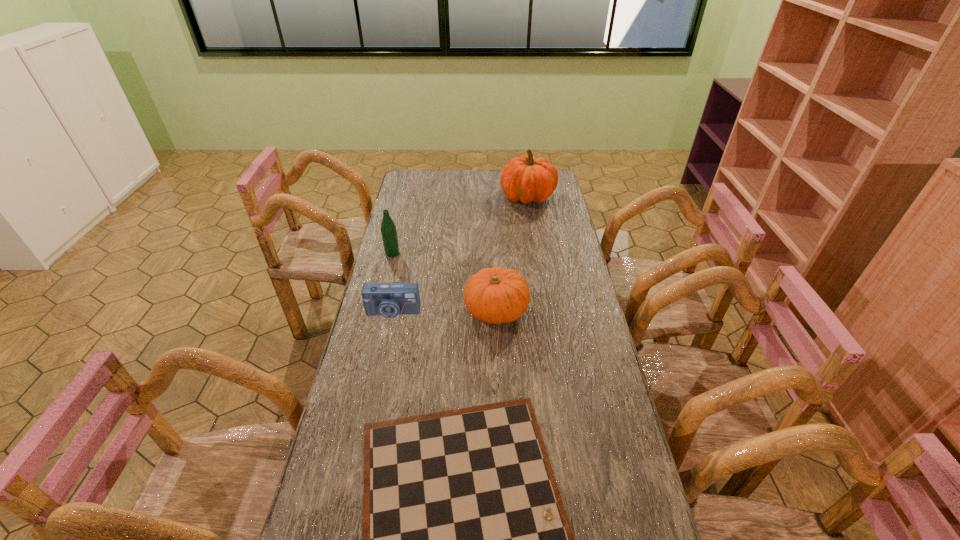
Locate an element on the screen. The width and height of the screenshot is (960, 540). empty space between the second shortest object and the bottle is located at coordinates (393, 282).

Identify the location of vacant area that lies between the second farthest object and the tallest object. click(460, 225).

This screenshot has height=540, width=960. Identify the location of free space between the nearer pumpkin and the tallest object. (512, 253).

Locate an element on the screen. The image size is (960, 540). unoccupied position between the third tallest object and the tallest object is located at coordinates (512, 253).

In order to click on empty location between the tallest object and the nearer pumpkin in this screenshot , I will do `click(512, 253)`.

Locate an element on the screen. Image resolution: width=960 pixels, height=540 pixels. free space that is in between the fourth nearest object and the camera is located at coordinates (393, 282).

Identify the location of free spot between the tallest object and the third tallest object. Image resolution: width=960 pixels, height=540 pixels. (512, 253).

Image resolution: width=960 pixels, height=540 pixels. In order to click on empty space between the tallest object and the camera in this screenshot , I will do (x=460, y=254).

The height and width of the screenshot is (540, 960). I want to click on object identified as the second closest to the camera, so click(x=388, y=228).

At what (x,y) coordinates should I click in order to perform the action: click on object that can be found as the second closest to the shortest object. Please return your answer as a coordinate pair (x, y). The height and width of the screenshot is (540, 960). Looking at the image, I should click on (389, 300).